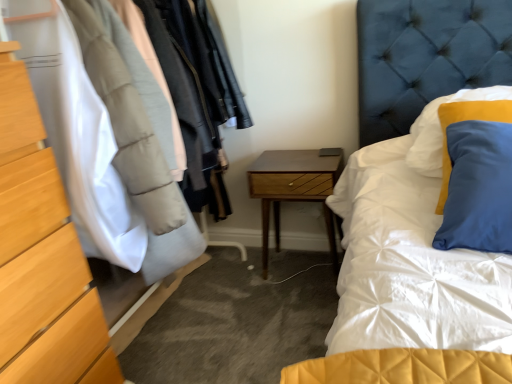
Identify the location of free region under woodenmaterial/texturenightstand at center (from a real-world perspective). This screenshot has height=384, width=512. point(305,253).